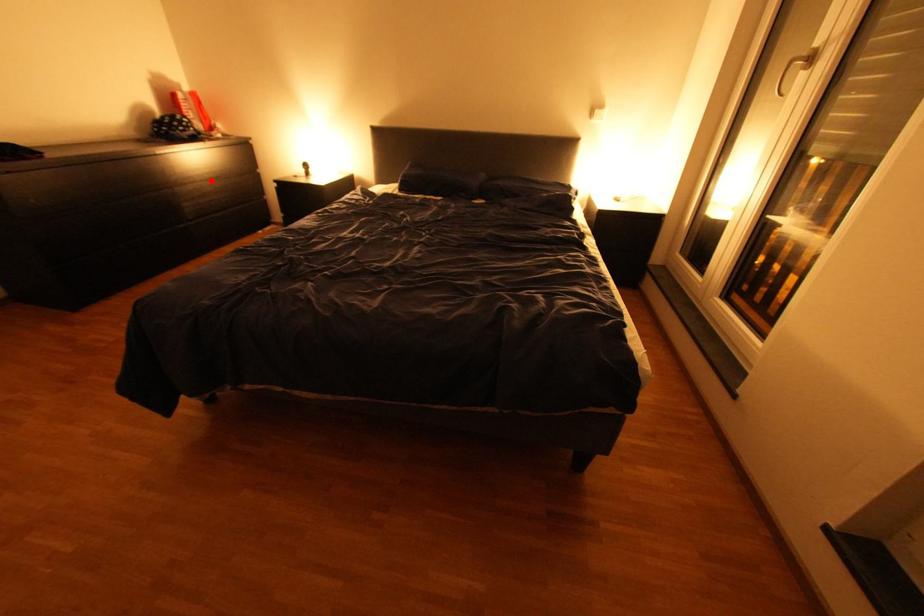
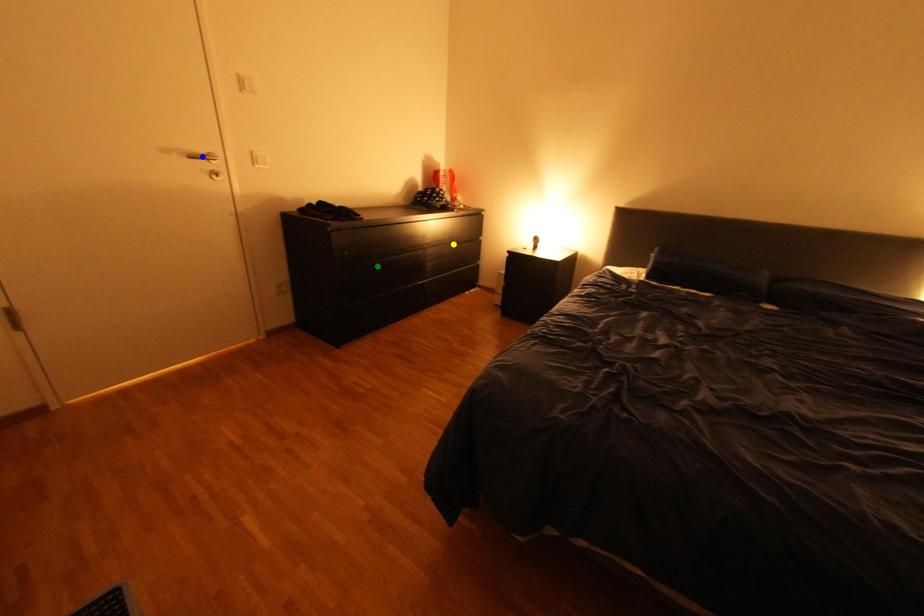
Question: I am providing you with two images of the same scene from different viewpoints. A red point is marked on the first image. You are given multiple points on the second image. Which point in image 2 is actually the same real-world point as the red point in image 1?

Choices:
 (A) green point
 (B) blue point
 (C) yellow point

Answer: (C)